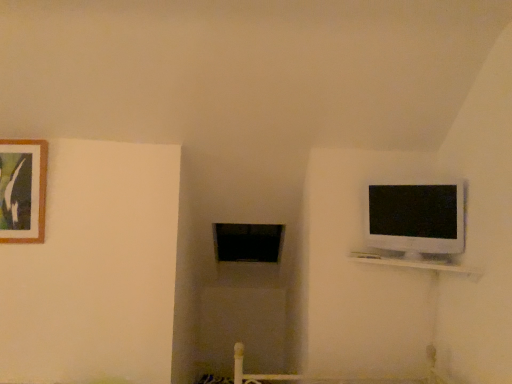
Describe the element at coordinates (23, 190) in the screenshot. I see `wooden picture frame at upper left` at that location.

Describe the element at coordinates (416, 219) in the screenshot. I see `white glossy television at upper right` at that location.

Find the location of a particular element. The image size is (512, 384). wooden picture frame at upper left is located at coordinates (23, 190).

Are white glossy television at upper right and white glossy shelf at upper right beside each other?

white glossy television at upper right and white glossy shelf at upper right are not in contact.

Considering the positions of points (399, 251) and (362, 253), is point (399, 251) closer to camera compared to point (362, 253)?

Yes, it is.

Which of these two, white glossy television at upper right or white glossy shelf at upper right, is wider?

Wider between the two is white glossy shelf at upper right.

Is point (391, 235) in front of point (41, 150)?

Yes.

Considering the relative sizes of white glossy television at upper right and wooden picture frame at upper left in the image provided, is white glossy television at upper right bigger than wooden picture frame at upper left?

Yes.

Is white glossy television at upper right positioned in front of wooden picture frame at upper left?

A: Yes.

Is white glossy television at upper right shorter than wooden picture frame at upper left?

Yes.

Can you confirm if white glossy shelf at upper right is positioned to the right of white glossy television at upper right?

No, white glossy shelf at upper right is not to the right of white glossy television at upper right.

Who is bigger, white glossy shelf at upper right or white glossy television at upper right?

With larger size is white glossy television at upper right.

Is the surface of white glossy shelf at upper right in direct contact with white glossy television at upper right?

white glossy shelf at upper right and white glossy television at upper right are not in contact.

Consider the image. From a real-world perspective, which object stands above the other?

white glossy television at upper right.

Relative to white glossy shelf at upper right, is wooden picture frame at upper left in front or behind?

Visually, wooden picture frame at upper left is located behind white glossy shelf at upper right.

Who is shorter, wooden picture frame at upper left or white glossy shelf at upper right?

white glossy shelf at upper right.

Consider the image. Would you say wooden picture frame at upper left is inside or outside white glossy shelf at upper right?

wooden picture frame at upper left is outside white glossy shelf at upper right.

Is white glossy shelf at upper right touching wooden picture frame at upper left?

white glossy shelf at upper right and wooden picture frame at upper left are not in contact.

Measure the distance from white glossy shelf at upper right to wooden picture frame at upper left.

white glossy shelf at upper right and wooden picture frame at upper left are 1.78 meters apart.

Do you think white glossy shelf at upper right is within wooden picture frame at upper left, or outside of it?

The correct answer is: outside.

In terms of size, does white glossy shelf at upper right appear bigger or smaller than wooden picture frame at upper left?

Clearly, white glossy shelf at upper right is larger in size than wooden picture frame at upper left.

From a real-world perspective, which is physically above, wooden picture frame at upper left or white glossy television at upper right?

wooden picture frame at upper left, from a real-world perspective.

Is wooden picture frame at upper left further to camera compared to white glossy television at upper right?

That is True.

This screenshot has height=384, width=512. What are the coordinates of `shelf that appears below the white glossy television at upper right (from a real-world perspective)` in the screenshot? It's located at point(414,263).

This screenshot has height=384, width=512. I want to click on picture frame on the left side of white glossy television at upper right, so click(23, 190).

Based on their spatial positions, is white glossy television at upper right or wooden picture frame at upper left further from white glossy shelf at upper right?

wooden picture frame at upper left lies further to white glossy shelf at upper right than the other object.

Estimate the real-world distances between objects in this image. Which object is further from wooden picture frame at upper left, white glossy television at upper right or white glossy shelf at upper right?

white glossy television at upper right is positioned further to the anchor wooden picture frame at upper left.

Considering their positions, is wooden picture frame at upper left positioned closer to white glossy shelf at upper right than white glossy television at upper right?

Based on the image, white glossy television at upper right appears to be nearer to white glossy shelf at upper right.

Estimate the real-world distances between objects in this image. Which object is further from white glossy television at upper right, wooden picture frame at upper left or white glossy shelf at upper right?

wooden picture frame at upper left is further to white glossy television at upper right.

Which object lies further to the anchor point wooden picture frame at upper left, white glossy shelf at upper right or white glossy television at upper right?

white glossy television at upper right lies further to wooden picture frame at upper left than the other object.

In the scene shown: Looking at the image, which one is located closer to white glossy television at upper right, white glossy shelf at upper right or wooden picture frame at upper left?

white glossy shelf at upper right is positioned closer to the anchor white glossy television at upper right.

Identify the location of shelf between wooden picture frame at upper left and white glossy television at upper right. The image size is (512, 384). [x=414, y=263].